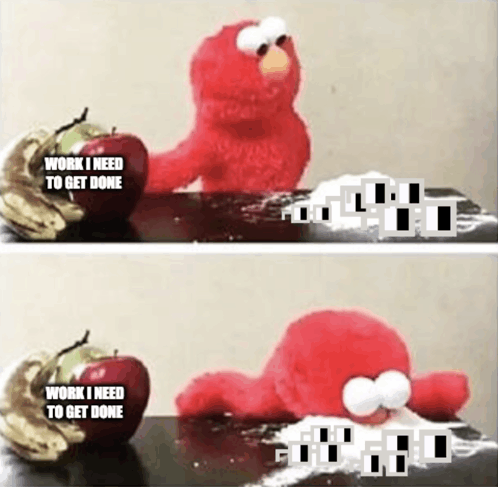
At what (x,y) coordinates should I click in order to perform the action: click on table. Please return your answer as a coordinate pair (x, y). Looking at the image, I should click on (10, 482), (163, 420), (170, 470), (347, 480), (472, 459), (469, 435), (440, 417), (93, 457).